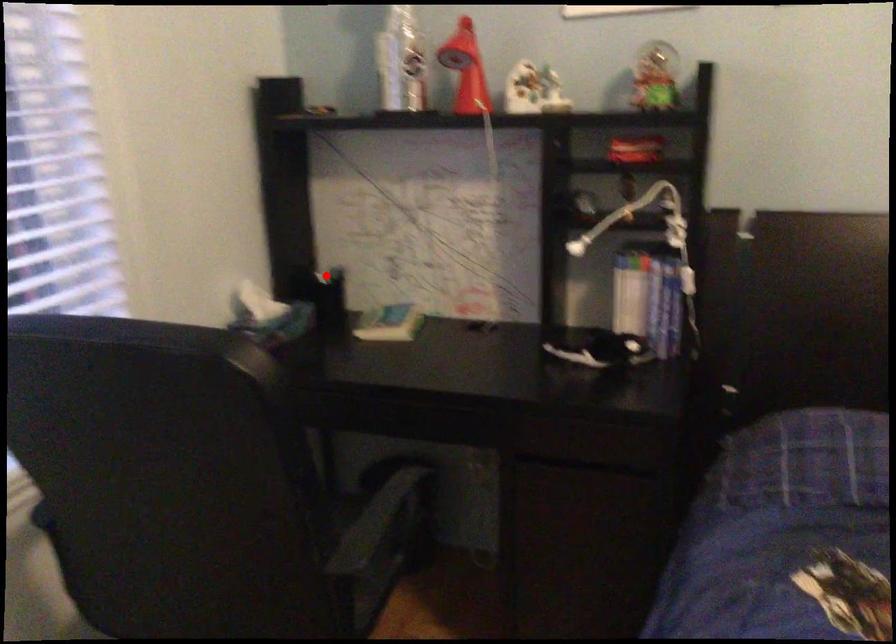
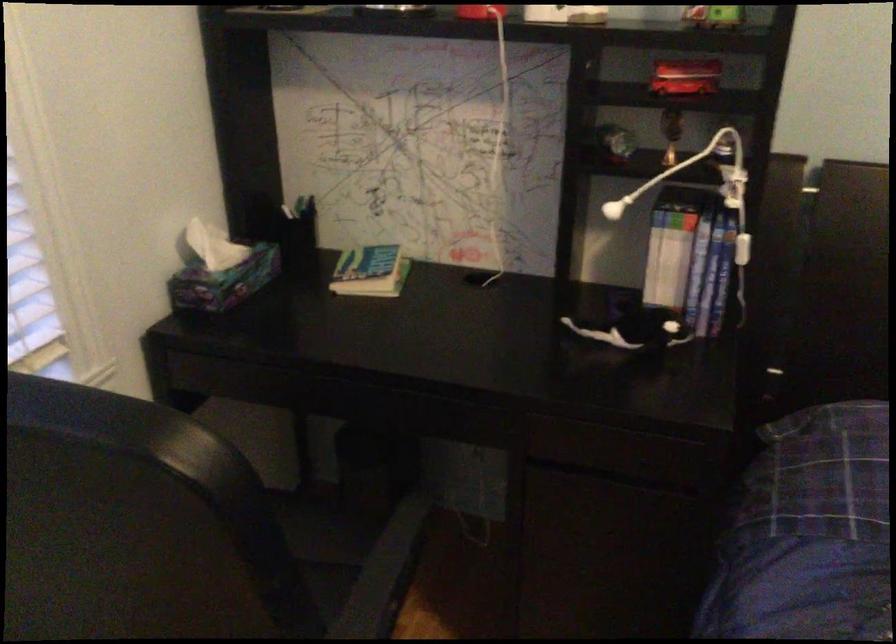
Question: I am providing you with two images of the same scene from different viewpoints. Given a red point in image1, look at the same physical point in image2. Is it:

Choices:
 (A) Closer to the viewpoint
 (B) Farther from the viewpoint

Answer: (A)